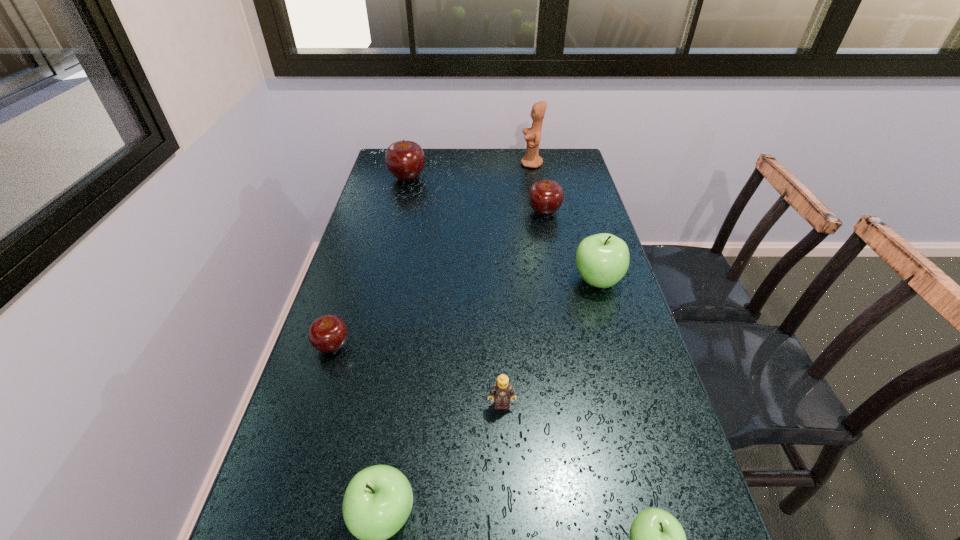
This screenshot has width=960, height=540. I want to click on apple present at the far edge, so click(405, 160).

The image size is (960, 540). Find the location of `figurine that is at the right edge`. figurine that is at the right edge is located at coordinates (531, 159).

In order to click on object that is positioned at the far left corner in this screenshot , I will do `click(405, 160)`.

Image resolution: width=960 pixels, height=540 pixels. In order to click on object located in the far right corner section of the desktop in this screenshot , I will do `click(531, 159)`.

Identify the location of vacant space at the far edge of the desktop. Image resolution: width=960 pixels, height=540 pixels. (423, 174).

Locate an element on the screen. free spot at the left edge of the desktop is located at coordinates (307, 533).

Locate an element on the screen. The height and width of the screenshot is (540, 960). vacant space at the right edge is located at coordinates (589, 212).

The image size is (960, 540). I want to click on free spot between the smallest red apple and the rightmost red apple, so click(439, 279).

Image resolution: width=960 pixels, height=540 pixels. I want to click on unoccupied position between the fifth nearest apple and the sixth farthest object, so click(x=523, y=308).

This screenshot has width=960, height=540. Identify the location of vacant point located between the smallest red apple and the biggest red apple. (x=370, y=261).